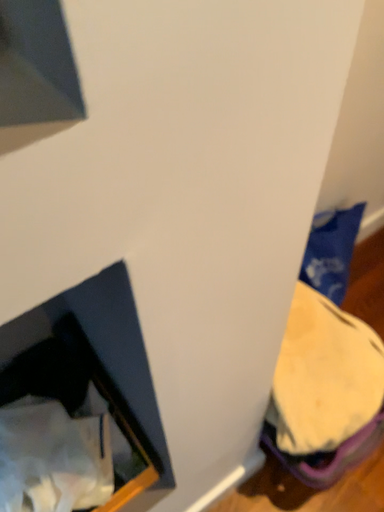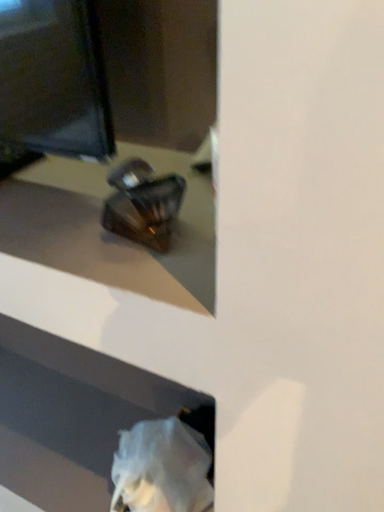
Question: Which way did the camera rotate in the video?

Choices:
 (A) rotated upward
 (B) rotated downward

Answer: (A)